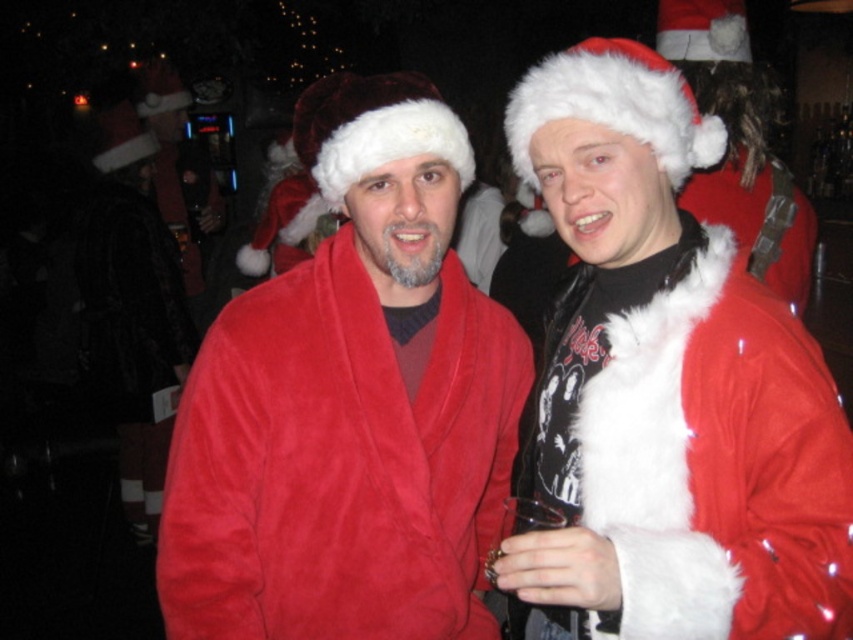
You are a photographer at a holiday party. You need to take a group photo of the matte red robe at center and the other person. How far apart should they stand to ensure both are in focus?

The matte red robe at center and the other person are 4.18 feet apart, so to ensure both are in focus, they should maintain this distance of 4.18 feet between them.

You are a photographer trying to capture a clear shot of both the matte red robe at center and the fuzzy red robe at right. Since you can only focus on one robe at a time, which robe should you focus on to ensure the other remains somewhat in focus?

The matte red robe at center is closer to you than the fuzzy red robe at right. By focusing on the matte red robe at center, the fuzzy red robe at right will be further away and may still be somewhat in focus due to the depth of field.